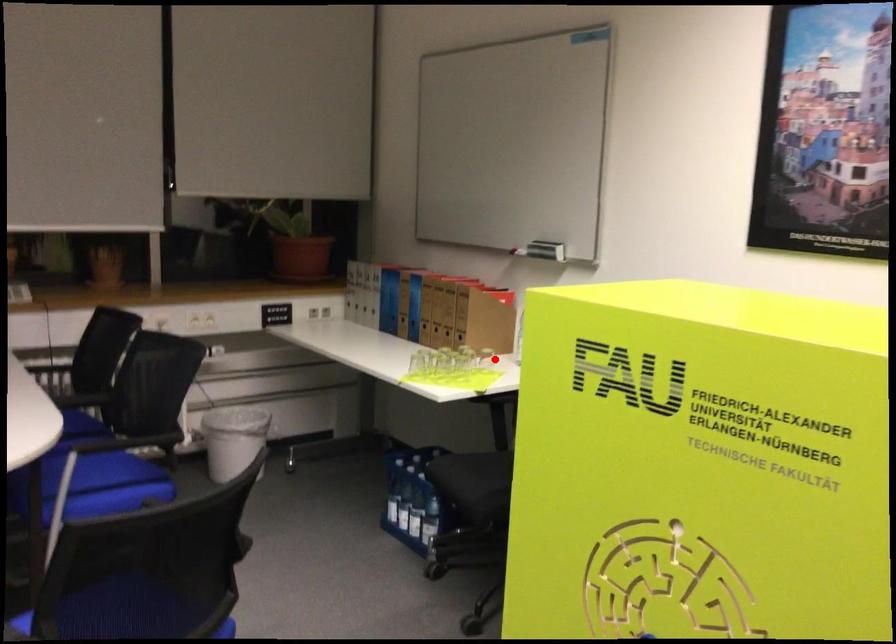
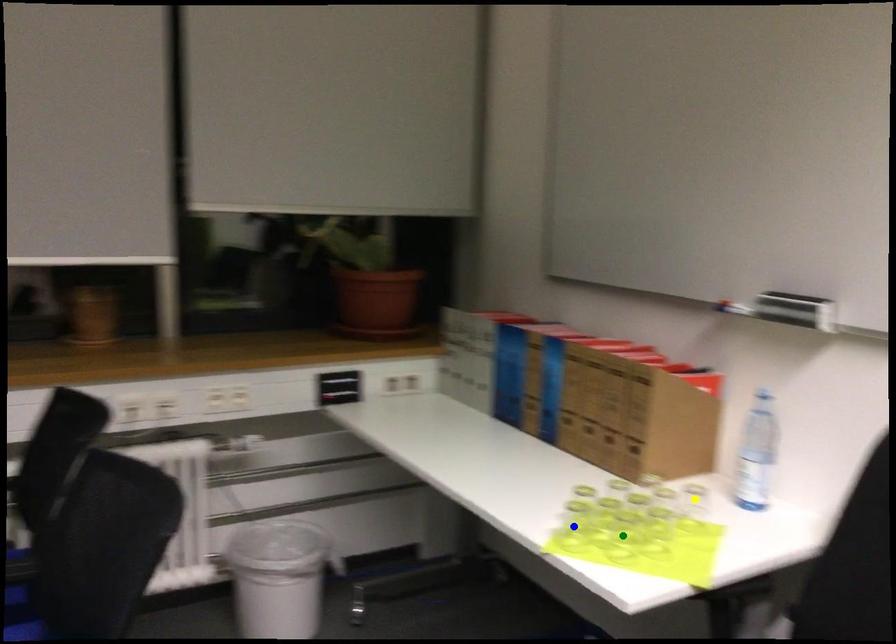
Question: I am providing you with two images of the same scene from different viewpoints. A red point is marked on the first image. You are given multiple points on the second image. Which spot in image 2 lines up with the point in image 1?

Choices:
 (A) yellow point
 (B) green point
 (C) blue point

Answer: (A)